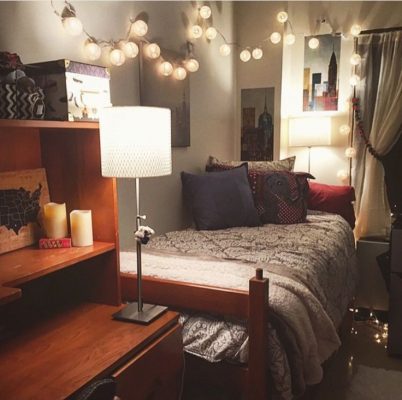
What are the coordinates of `floor` in the screenshot? It's located at (361, 354).